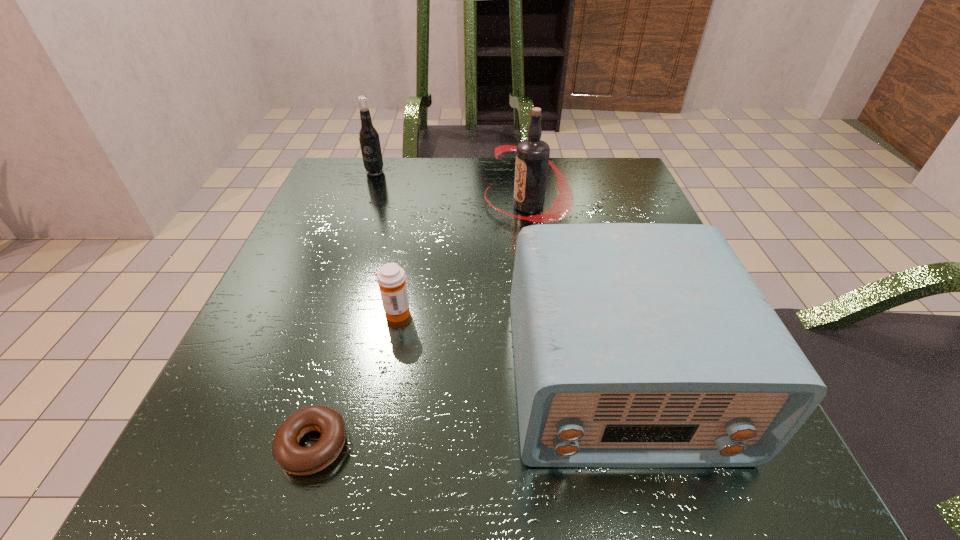
Identify the location of object located in the near left corner section of the desktop. (288, 454).

I want to click on object positioned at the near right corner, so [636, 345].

Locate an element on the screen. The width and height of the screenshot is (960, 540). vacant space at the far edge of the desktop is located at coordinates (444, 184).

Identify the location of vacant space at the near edge of the desktop. (358, 455).

This screenshot has width=960, height=540. In the image, there is a desktop. Identify the location of vacant space at the left edge. coord(324,301).

What are the coordinates of `vacant space at the right edge of the desktop` in the screenshot? It's located at (624, 212).

What are the coordinates of `vacant space at the near left corner` in the screenshot? It's located at (220, 450).

This screenshot has height=540, width=960. In order to click on vacant space at the far right corner in this screenshot , I will do `click(620, 199)`.

You are a GUI agent. You are given a task and a screenshot of the screen. Output one action in this format:
    pyautogui.click(x=<x>, y=<y>)
    Task: Click on the vacant region between the radio receiver and the farthest object
    The image size is (960, 540).
    Given the screenshot: What is the action you would take?
    pyautogui.click(x=496, y=275)

Locate an element on the screen. The height and width of the screenshot is (540, 960). free space between the shortest object and the radio receiver is located at coordinates (466, 412).